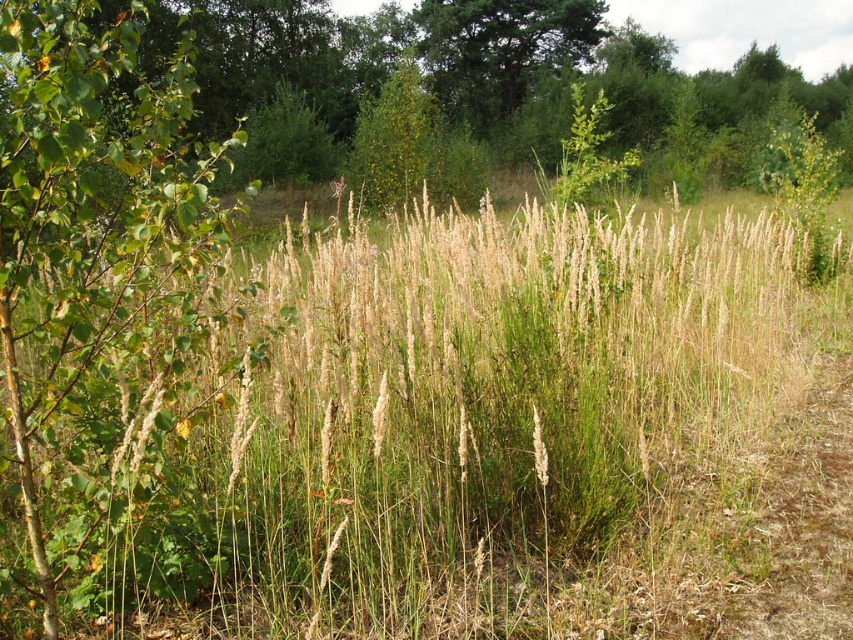
The image size is (853, 640). Identify the location of dry grass at center. (480, 436).

In the scene shown: Is dry grass at center behind green leafy tree at left?

That is False.

Is point (817, 314) positioned before point (129, 45)?

No, it is not.

Image resolution: width=853 pixels, height=640 pixels. In order to click on dry grass at center in this screenshot , I will do `click(480, 436)`.